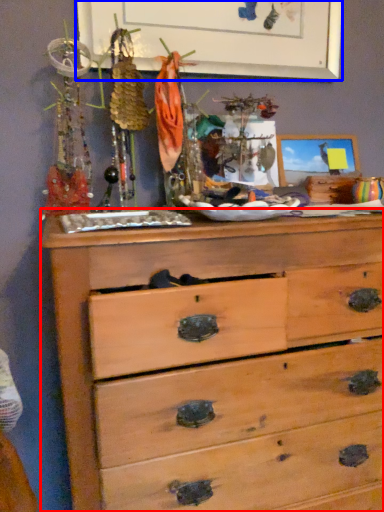
Question: Among these objects, which one is nearest to the camera, chest of drawers (highlighted by a red box) or bulletin board (highlighted by a blue box)?

Choices:
 (A) chest of drawers
 (B) bulletin board

Answer: (A)